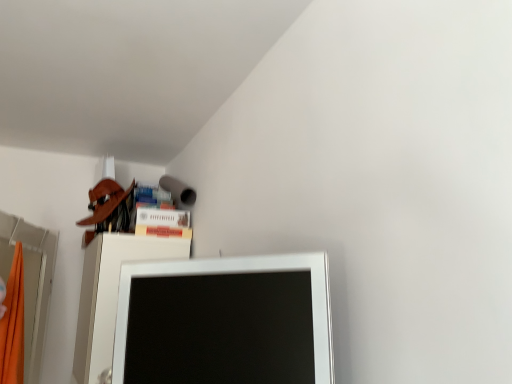
This screenshot has height=384, width=512. What do you see at coordinates (224, 321) in the screenshot?
I see `matte white computer monitor at center` at bounding box center [224, 321].

You are a GUI agent. You are given a task and a screenshot of the screen. Output one action in this format:
    pyautogui.click(x=<x>, y=<y>)
    Task: Click on the matte white computer monitor at center
    The width and height of the screenshot is (512, 384).
    Given the screenshot: What is the action you would take?
    pyautogui.click(x=224, y=321)

Identify the location of matte white computer monitor at center. This screenshot has width=512, height=384. (224, 321).